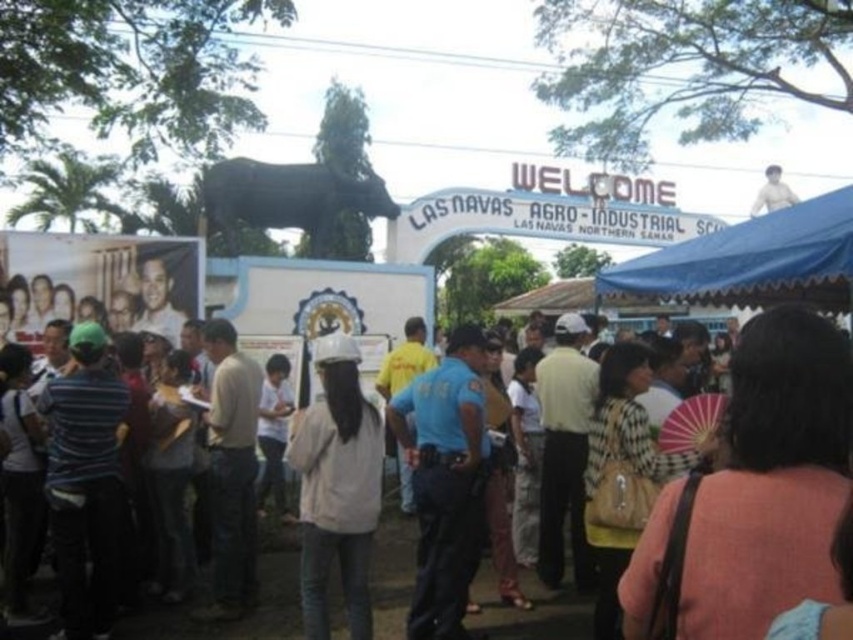
You are standing at the entrance of the Las Navas Agro Industrial School and want to walk towards the point marked as point (376, 484). Will you pass by point (744, 252) on your way?

Since point (376, 484) is in front of point (744, 252), you will not pass by point (744, 252) on your way to point (376, 484). The point (376, 484) is closer to your current position at the entrance.

You are a photographer standing at the event entrance. You want to take a photo of the white matte hard hat at center. Can you capture it in your shot if your camera has a maximum focus range of 80 meters?

The white matte hard hat at center is 85.50 meters from the camera. Since the camera can only focus up to 80 meters, it cannot capture the white matte hard hat at center clearly.

You are an event organizer at the Las Navas Agro Industrial School event. You need to place a temporary stand for safety instructions. The stand must be placed in a location where it can be easily seen by everyone. Considering the white matte hard hat at center and the black matte statue at upper center, which object is wider and thus would make a better reference point for positioning the stand to ensure visibility?

The black matte statue at upper center is wider than the white matte hard hat at center. Therefore, positioning the stand near the black matte statue at upper center would provide a better reference point for visibility as it has a larger width.